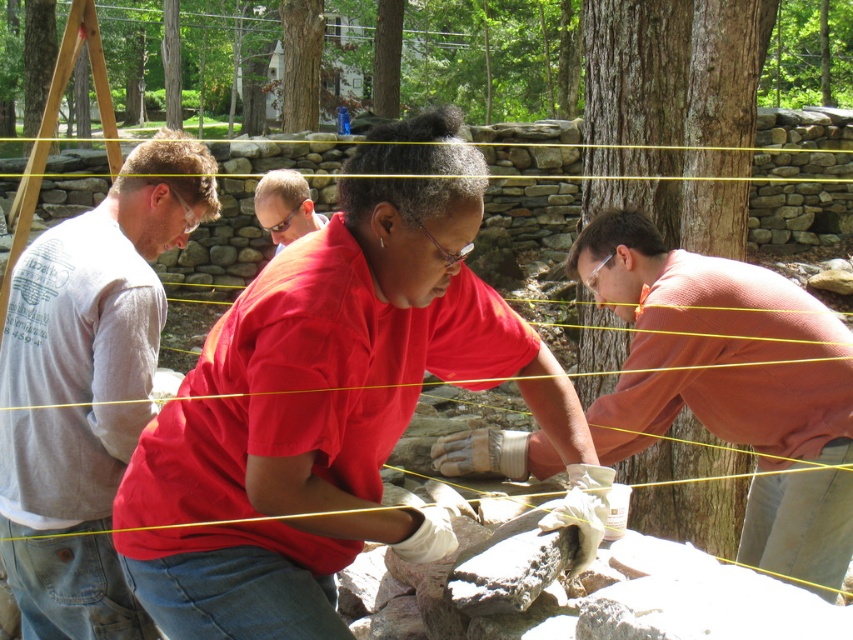
Who is more distant from viewer, (372,448) or (283,236)?

The point (283,236) is more distant.

Does matte gray shirt at center appear on the right side of matte black glasses at center?

Indeed, matte gray shirt at center is positioned on the right side of matte black glasses at center.

Does point (296, 561) lie in front of point (289, 214)?

That is True.

At what (x,y) coordinates should I click in order to perform the action: click on matte gray shirt at center. Please return your answer as a coordinate pair (x, y). The height and width of the screenshot is (640, 853). Looking at the image, I should click on (326, 401).

Who is positioned more to the left, matte orange shirt at center or matte black glasses at center?

From the viewer's perspective, matte black glasses at center appears more on the left side.

Locate an element on the screen. matte orange shirt at center is located at coordinates (730, 384).

Can you confirm if matte gray shirt at center is smaller than matte orange shirt at center?

Correct, matte gray shirt at center occupies less space than matte orange shirt at center.

Is point (404, 547) behind point (604, 260)?

That is False.

Find the location of `matte gray shirt at center`. matte gray shirt at center is located at coordinates click(326, 401).